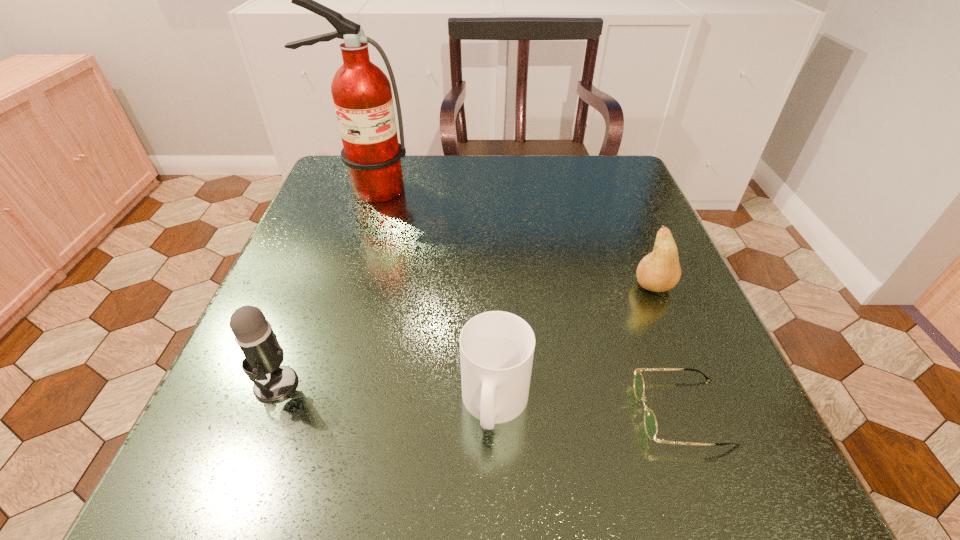
Find the location of a particular element. The width and height of the screenshot is (960, 540). the tallest object is located at coordinates 362,95.

The height and width of the screenshot is (540, 960). Identify the location of fire extinguisher. (362, 95).

You are a GUI agent. You are given a task and a screenshot of the screen. Output one action in this format:
    pyautogui.click(x=<x>, y=<y>)
    Task: Click on the microphone
    This screenshot has width=960, height=540.
    Given the screenshot: What is the action you would take?
    pyautogui.click(x=254, y=335)

This screenshot has height=540, width=960. I want to click on pear, so click(x=659, y=271).

The height and width of the screenshot is (540, 960). What are the coordinates of `the third object from right to left` in the screenshot? It's located at (496, 348).

Locate an element on the screen. spectacles is located at coordinates (650, 422).

What are the coordinates of `free point located 0.320m on the nozzle and handle of the tallest object` in the screenshot? It's located at (324, 309).

This screenshot has height=540, width=960. Identify the location of vacant space located 0.080m on the back of the microphone. (299, 325).

Find the location of a particular element. free space located 0.310m on the left of the pear is located at coordinates (462, 286).

This screenshot has height=540, width=960. What are the coordinates of `vacant space located 0.070m on the handle side of the mug` in the screenshot? It's located at (498, 504).